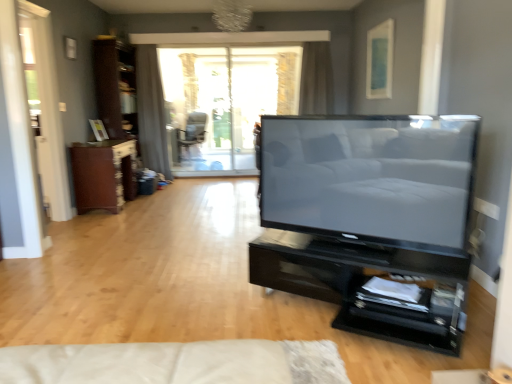
What are the coordinates of `brown wood cabinet at left` in the screenshot? It's located at (103, 174).

What do you see at coordinates (371, 178) in the screenshot?
I see `matte black tv at center` at bounding box center [371, 178].

Find the location of a particular element. The image size is (512, 384). transparent glass window at center is located at coordinates [x=224, y=103].

Where is `matte blue picture frame at upper right, the 2th picture frame when ordered from bottom to top`? This screenshot has height=384, width=512. matte blue picture frame at upper right, the 2th picture frame when ordered from bottom to top is located at coordinates (380, 61).

From the image's perspective, which one is positioned higher, transparent glass window at center or matte white picture frame at upper left, which is the first picture frame in bottom-to-top order?

From the image's view, transparent glass window at center is above.

Image resolution: width=512 pixels, height=384 pixels. I want to click on window screen lying behind the matte white picture frame at upper left, arranged as the 2th picture frame when viewed from the right, so click(x=224, y=103).

Is transparent glass window at center further to camera compared to matte white picture frame at upper left, acting as the second picture frame starting from the top?

Yes, the depth of transparent glass window at center is greater than that of matte white picture frame at upper left, acting as the second picture frame starting from the top.

Which is correct: transparent glass window at center is inside matte white picture frame at upper left, which is the first picture frame in bottom-to-top order, or outside of it?

transparent glass window at center is not enclosed by matte white picture frame at upper left, which is the first picture frame in bottom-to-top order.

What's the angular difference between matte black chair at center and brown wood dresser at left's facing directions?

The angular difference between matte black chair at center and brown wood dresser at left is 114 degrees.

Looking at this image, is matte black chair at center oriented away from brown wood dresser at left?

That's not correct — matte black chair at center is not looking away from brown wood dresser at left.

From the picture: Between matte black chair at center and brown wood dresser at left, which one has smaller width?

With smaller width is brown wood dresser at left.

Is brown wood dresser at left a part of matte black chair at center?

No, brown wood dresser at left is located outside of matte black chair at center.

Which is closer, (155, 79) or (330, 292)?

The point (330, 292) is closer.

Are gray fabric curtain at upper center, positioned as the 2th curtain in right-to-left order, and black glossy shelf at lower right beside each other?

gray fabric curtain at upper center, positioned as the 2th curtain in right-to-left order, and black glossy shelf at lower right are clearly separated.

Can you tell me how much gray fabric curtain at upper center, positioned as the 2th curtain in right-to-left order, and black glossy shelf at lower right differ in facing direction?

The angle between the facing direction of gray fabric curtain at upper center, positioned as the 2th curtain in right-to-left order, and the facing direction of black glossy shelf at lower right is 31.7 degrees.

Which point is more distant from viewer, (368, 306) or (98, 134)?

Point (98, 134)

Can you confirm if black glossy shelf at lower right is smaller than matte white picture frame at upper left, arranged as the 2th picture frame when viewed from the right?

No.

From the image's perspective, which object appears higher, black glossy shelf at lower right or matte white picture frame at upper left, which is the first picture frame in bottom-to-top order?

matte white picture frame at upper left, which is the first picture frame in bottom-to-top order, appears higher in the image.

Considering the relative sizes of black glossy shelf at lower right and matte white picture frame at upper left, acting as the second picture frame starting from the top, in the image provided, is black glossy shelf at lower right taller than matte white picture frame at upper left, acting as the second picture frame starting from the top,?

Yes, black glossy shelf at lower right is taller than matte white picture frame at upper left, acting as the second picture frame starting from the top.

Is matte blue picture frame at upper right, acting as the first picture frame starting from the right, positioned beyond the bounds of matte black chair at center?

That's correct, matte blue picture frame at upper right, acting as the first picture frame starting from the right, is outside of matte black chair at center.

Can you tell me how much matte blue picture frame at upper right, acting as the first picture frame starting from the right, and matte black chair at center differ in facing direction?

The angle between the facing direction of matte blue picture frame at upper right, acting as the first picture frame starting from the right, and the facing direction of matte black chair at center is 66 degrees.

Considering the sizes of matte blue picture frame at upper right, the 2th picture frame when ordered from bottom to top, and matte black chair at center in the image, is matte blue picture frame at upper right, the 2th picture frame when ordered from bottom to top, taller or shorter than matte black chair at center?

matte blue picture frame at upper right, the 2th picture frame when ordered from bottom to top, is shorter than matte black chair at center.

Is matte blue picture frame at upper right, the first picture frame from the top, at the left side of matte black chair at center?

Incorrect, matte blue picture frame at upper right, the first picture frame from the top, is not on the left side of matte black chair at center.

From the image's perspective, which is below, brown wood cabinet at left or matte black tv at center?

matte black tv at center appears lower in the image.

Can you tell me how much brown wood cabinet at left and matte black tv at center differ in facing direction?

brown wood cabinet at left and matte black tv at center are facing 120 degrees away from each other.

Consider the image. Is brown wood cabinet at left with matte black tv at center?

No, brown wood cabinet at left is not beside matte black tv at center.

Is brown wood cabinet at left oriented away from matte black tv at center?

No, brown wood cabinet at left's orientation is not away from matte black tv at center.

Which is closer to the camera, (204, 113) or (124, 156)?

Clearly, point (204, 113) is more distant from the camera than point (124, 156).

What's the angular difference between matte black chair at center and brown wood cabinet at left's facing directions?

113 degrees separate the facing orientations of matte black chair at center and brown wood cabinet at left.

Is brown wood cabinet at left at the back of matte black chair at center?

That's not correct — matte black chair at center is not looking away from brown wood cabinet at left.

From a real-world perspective, is matte black chair at center located beneath brown wood cabinet at left?

Actually, matte black chair at center is physically above brown wood cabinet at left in the real world.

Where is `window screen behind the matte white picture frame at upper left, positioned as the 1th picture frame in left-to-right order`? The image size is (512, 384). window screen behind the matte white picture frame at upper left, positioned as the 1th picture frame in left-to-right order is located at coordinates (224, 103).

Image resolution: width=512 pixels, height=384 pixels. In order to click on dresser above the matte black chair at center (from a real-world perspective) in this screenshot , I will do `click(115, 87)`.

Considering their positions, is matte black chair at center positioned closer to transparent glass window at center than matte black tv at center?

matte black chair at center is positioned closer to the anchor transparent glass window at center.

Estimate the real-world distances between objects in this image. Which object is further from matte blue picture frame at upper right, the 2th picture frame when ordered from bottom to top, matte white picture frame at upper left, acting as the second picture frame starting from the top, or white glossy screen door at left?

white glossy screen door at left.

From the image, which object appears to be nearer to white glossy screen door at left, brown wood dresser at left or black glossy shelf at lower right?

Among the two, brown wood dresser at left is located nearer to white glossy screen door at left.

From the image, which object appears to be nearer to transparent glass window at center, matte black tv at center or brown wood dresser at left?

brown wood dresser at left is closer to transparent glass window at center.

Estimate the real-world distances between objects in this image. Which object is further from brown wood dresser at left, matte blue picture frame at upper right, the second picture frame positioned from the left, or matte black chair at center?

Among the two, matte blue picture frame at upper right, the second picture frame positioned from the left, is located further to brown wood dresser at left.

From the image, which object appears to be nearer to matte black chair at center, matte white picture frame at upper left, which is the first picture frame in bottom-to-top order, or matte black tv at center?

matte white picture frame at upper left, which is the first picture frame in bottom-to-top order.

Based on their spatial positions, is brown wood dresser at left or matte black tv at center closer to gray fabric curtain at upper center, positioned as the 2th curtain in right-to-left order?

The object closer to gray fabric curtain at upper center, positioned as the 2th curtain in right-to-left order, is brown wood dresser at left.

Considering their positions, is brown wood dresser at left positioned closer to black glossy shelf at lower right than gray fabric curtain at upper center, the first curtain when ordered from left to right?

brown wood dresser at left is closer to black glossy shelf at lower right.

Image resolution: width=512 pixels, height=384 pixels. Find the location of `curtain located between matte white picture frame at upper left, arranged as the 2th picture frame when viewed from the right, and satin gray curtain at upper center, placed as the second curtain when sorted from left to right, in the left-right direction`. curtain located between matte white picture frame at upper left, arranged as the 2th picture frame when viewed from the right, and satin gray curtain at upper center, placed as the second curtain when sorted from left to right, in the left-right direction is located at coordinates (151, 111).

Locate an element on the screen. Image resolution: width=512 pixels, height=384 pixels. window screen located between brown wood cabinet at left and matte blue picture frame at upper right, acting as the first picture frame starting from the right, in the left-right direction is located at coordinates (224, 103).

At what (x,y) coordinates should I click in order to perform the action: click on chair located between gray fabric curtain at upper center, the first curtain when ordered from left to right, and satin gray curtain at upper center, the first curtain positioned from the right, in the left-right direction. Please return your answer as a coordinate pair (x, y). Looking at the image, I should click on (191, 136).

This screenshot has height=384, width=512. In order to click on cabinetry between white glossy screen door at left and transparent glass window at center in the front-back direction in this screenshot , I will do `click(103, 174)`.